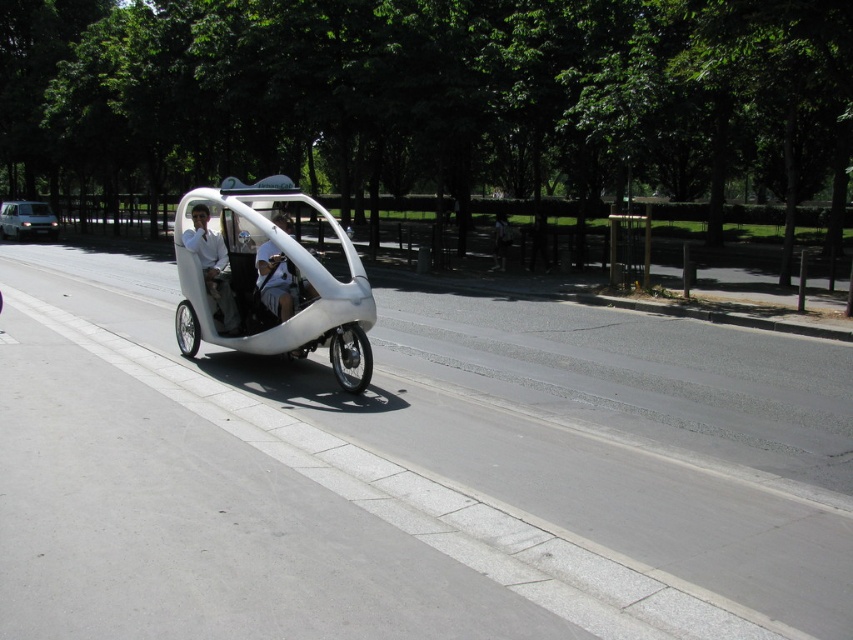
You are a delivery person who needs to carry a large package that is 1 meter wide. You see the white matte sidecar at center and the white matte helmet at center. Can the package fit in the sidecar?

The white matte sidecar at center might be wider than white matte helmet at center, so the package may fit if the sidecar is indeed wider than 1 meter. However, since the exact width isn

You are a delivery person needing to park your 1.5 meter wide bike. You see the white matte sidecar at center and the silver metallic van at left. Which parking spot can accommodate your bike if the spot must be wider than 1.5 meters?

The white matte sidecar at center has a width larger than the silver metallic van at left, so the parking spot where the white matte sidecar at center is parked can accommodate your 1.5 meter wide bike since it is wider.

You are a passenger in the white matte sidecar at center of the pedicab. You want to place your helmet somewhere safe while riding. Can you put your white matte helmet at center in the sidecar?

The white matte sidecar at center is located above the white matte helmet at center. Since the sidecar is above the helmet, you cannot place the helmet inside the sidecar because it is already positioned below it.